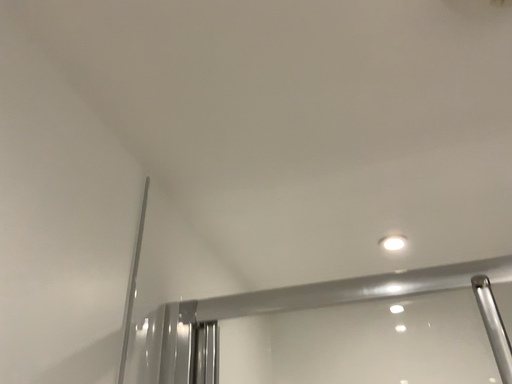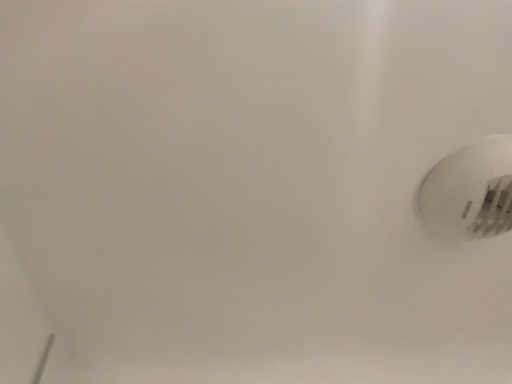
Question: Which way did the camera rotate in the video?

Choices:
 (A) rotated right
 (B) rotated left

Answer: (A)